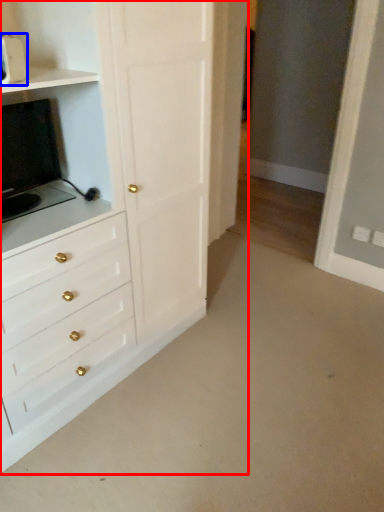
Question: Which point is further to the camera, chest of drawers (highlighted by a red box) or appliance (highlighted by a blue box)?

Choices:
 (A) chest of drawers
 (B) appliance

Answer: (B)